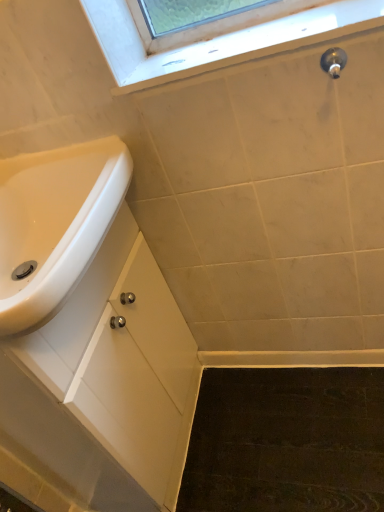
Question: Can we say white glossy sink at lower left lies outside white matte cabinet at lower left?

Choices:
 (A) yes
 (B) no

Answer: (A)

Question: Considering the relative positions of white glossy sink at lower left and white matte cabinet at lower left in the image provided, is white glossy sink at lower left to the left of white matte cabinet at lower left from the viewer's perspective?

Choices:
 (A) yes
 (B) no

Answer: (A)

Question: From the image's perspective, does white glossy sink at lower left appear lower than white matte cabinet at lower left?

Choices:
 (A) yes
 (B) no

Answer: (B)

Question: Considering the relative positions of white glossy sink at lower left and white matte cabinet at lower left in the image provided, is white glossy sink at lower left in front of white matte cabinet at lower left?

Choices:
 (A) no
 (B) yes

Answer: (B)

Question: Is white glossy sink at lower left shorter than white matte cabinet at lower left?

Choices:
 (A) no
 (B) yes

Answer: (B)

Question: Does white glossy sink at lower left have a greater width compared to white matte cabinet at lower left?

Choices:
 (A) yes
 (B) no

Answer: (A)

Question: Could you tell me if white glossy sink at lower left is facing polished chrome faucet at upper right?

Choices:
 (A) yes
 (B) no

Answer: (A)

Question: Does white glossy sink at lower left lie behind polished chrome faucet at upper right?

Choices:
 (A) no
 (B) yes

Answer: (A)

Question: From a real-world perspective, is white glossy sink at lower left located higher than polished chrome faucet at upper right?

Choices:
 (A) yes
 (B) no

Answer: (B)

Question: Is white glossy sink at lower left turned away from polished chrome faucet at upper right?

Choices:
 (A) yes
 (B) no

Answer: (B)

Question: Is white glossy sink at lower left at the right side of polished chrome faucet at upper right?

Choices:
 (A) no
 (B) yes

Answer: (A)

Question: Is polished chrome faucet at upper right inside white glossy sink at lower left?

Choices:
 (A) yes
 (B) no

Answer: (B)

Question: Is polished chrome faucet at upper right turned away from white matte cabinet at lower left?

Choices:
 (A) yes
 (B) no

Answer: (B)